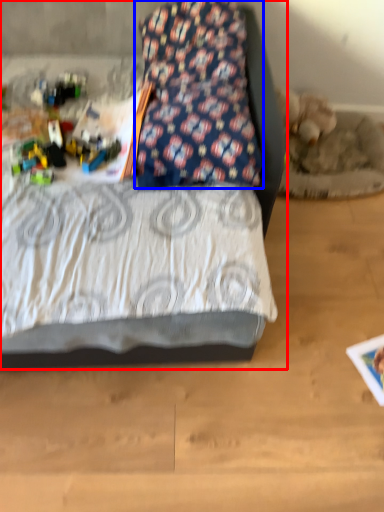
Question: Which object is closer to the camera taking this photo, bed (highlighted by a red box) or pillow (highlighted by a blue box)?

Choices:
 (A) bed
 (B) pillow

Answer: (A)